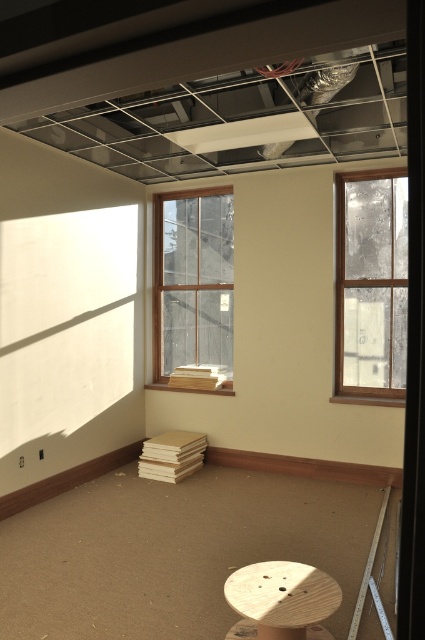
You are a contractor assessing the space. You need to place a large equipment that requires a clear area. Which object between the clear glass window at center and wooden stool at lower center should you avoid placing the equipment in front of to ensure it doesn,t block the window?

You should avoid placing the equipment in front of the clear glass window at center because it has a larger size compared to the wooden stool at lower center, so blocking it would obstruct more of the space and the window.

You are standing in the room and want to look outside through the windows. Which window, the clear glass window at right or the clear glass window at center, is positioned farther to the east?

The clear glass window at right is positioned farther to the east because it is to the right of the clear glass window at center.

You are a construction worker who needs to access the clear glass window at right for repairs. Given the room layout described, can you determine if the window is positioned near the left wall or the right wall?

The clear glass window at right is located at point (371, 284), which places it near the right wall of the room, so it is positioned near the right wall.